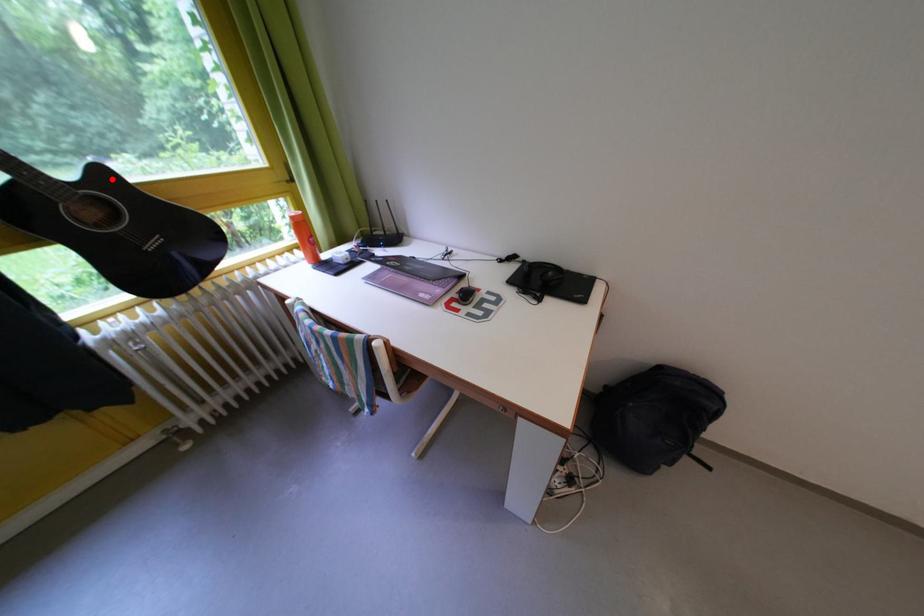
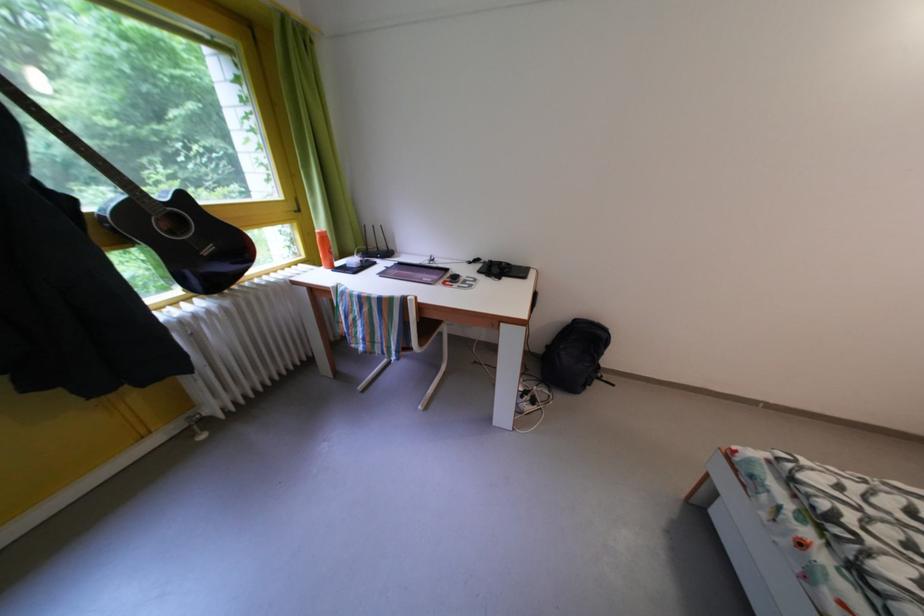
Where in the second image is the point corresponding to the highlighted location from the first image?

(191, 203)